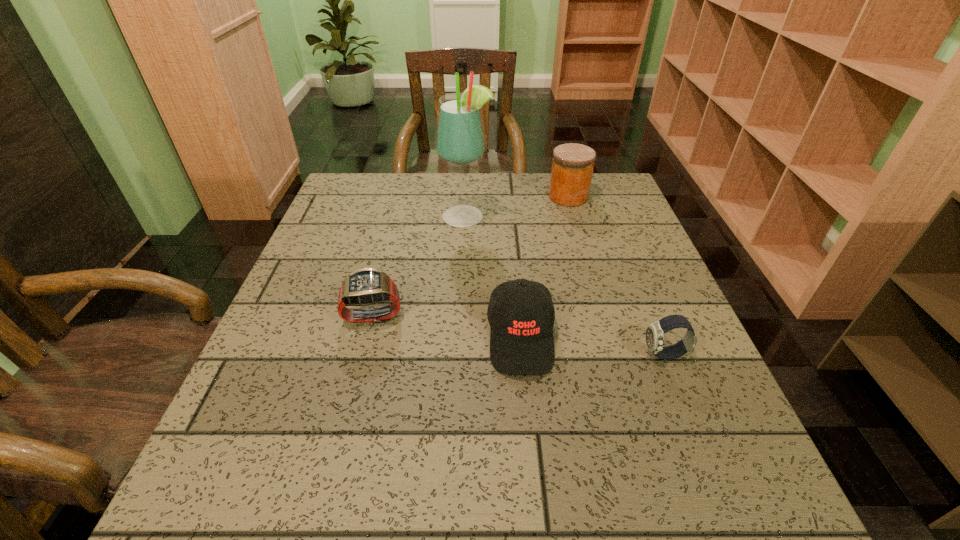
Where is `vacant space that's between the alcohol and the nearer watch`? Image resolution: width=960 pixels, height=540 pixels. vacant space that's between the alcohol and the nearer watch is located at coordinates (564, 286).

Locate an element on the screen. free space between the right watch and the jar is located at coordinates (616, 275).

This screenshot has width=960, height=540. In order to click on empty space between the baseball cap and the left watch in this screenshot , I will do `click(447, 326)`.

At what (x,y) coordinates should I click in order to perform the action: click on free space between the baseball cap and the second tallest object. Please return your answer as a coordinate pair (x, y). Looking at the image, I should click on (544, 267).

Select which object appears as the third closest to the tallest object. Please provide its 2D coordinates. Your answer should be formatted as a tuple, i.e. [(x, y)], where the tuple contains the x and y coordinates of a point satisfying the conditions above.

[(367, 286)]

The height and width of the screenshot is (540, 960). I want to click on object that is the fourth closest to the baseball cap, so [x=572, y=168].

This screenshot has width=960, height=540. In order to click on vacant space that satisfies the following two spatial constraints: 1. on the back side of the second tallest object; 2. on the right side of the farther watch in this screenshot , I will do `click(403, 197)`.

Locate an element on the screen. free location that satisfies the following two spatial constraints: 1. on the back side of the left watch; 2. on the left side of the jar is located at coordinates (403, 197).